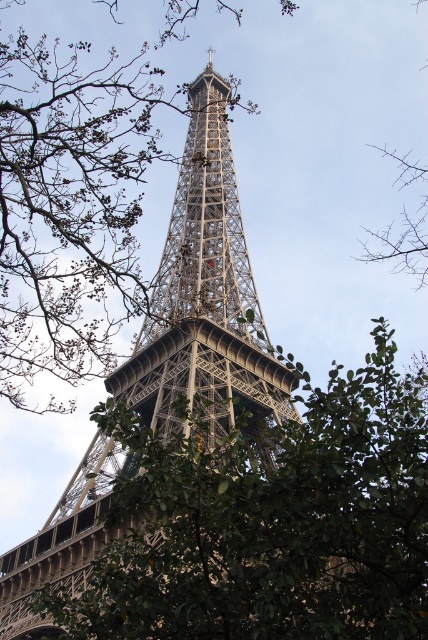
Question: Considering the real-world distances, which object is farthest from the green leafy tree at center?

Choices:
 (A) metallic lattice tower at center
 (B) bare branches at upper right

Answer: (B)

Question: Which point is closer to the camera taking this photo?

Choices:
 (A) (94, 577)
 (B) (220, 241)

Answer: (A)

Question: Among these points, which one is farthest from the camera?

Choices:
 (A) (299, 568)
 (B) (21, 577)

Answer: (B)

Question: Is green leafy tree at center behind bare branches at upper right?

Choices:
 (A) yes
 (B) no

Answer: (B)

Question: Observing the image, what is the correct spatial positioning of green leafy tree at center in reference to bare branches at upper right?

Choices:
 (A) above
 (B) below

Answer: (B)

Question: Can you confirm if green leafy tree at center is positioned below bare branches at upper right?

Choices:
 (A) yes
 (B) no

Answer: (A)